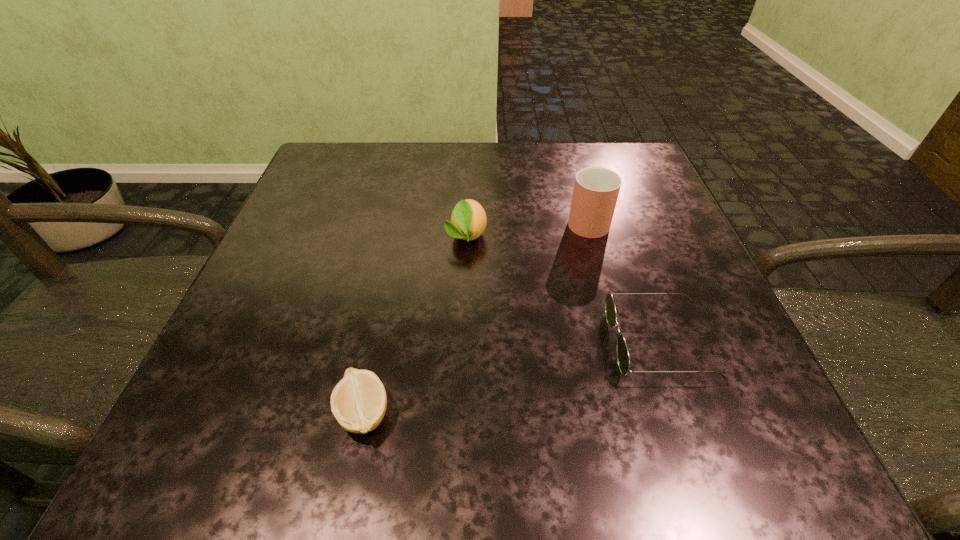
Locate an element on the screen. Image resolution: width=960 pixels, height=540 pixels. vacant area at the right edge of the desktop is located at coordinates (711, 393).

Identify the location of vacant region at the far left corner. The image size is (960, 540). (349, 156).

This screenshot has width=960, height=540. Find the location of `vacant space at the near left corner of the desktop`. vacant space at the near left corner of the desktop is located at coordinates (236, 455).

Find the location of a particular element. The image size is (960, 540). free space at the far right corner is located at coordinates (634, 170).

You are a GUI agent. You are given a task and a screenshot of the screen. Output one action in this format:
    pyautogui.click(x=<x>, y=<y>)
    Task: Click on the vacant region between the sunglasses and the tallest object
    The height and width of the screenshot is (540, 960).
    Given the screenshot: What is the action you would take?
    pyautogui.click(x=623, y=281)

This screenshot has height=540, width=960. I want to click on empty location between the farther lemon and the tallest object, so click(527, 227).

Find the location of a particular element. Image resolution: width=960 pixels, height=540 pixels. free point between the sunglasses and the shorter lemon is located at coordinates (511, 378).

The width and height of the screenshot is (960, 540). Identify the location of blank region between the tallest object and the nearer lemon. (475, 316).

At what (x,y) coordinates should I click in order to perform the action: click on vacant area between the sunglasses and the right lemon. Please return your answer as a coordinate pair (x, y). The height and width of the screenshot is (540, 960). Looking at the image, I should click on (563, 289).

The image size is (960, 540). I want to click on vacant area that lies between the sunglasses and the shortest object, so (x=511, y=378).